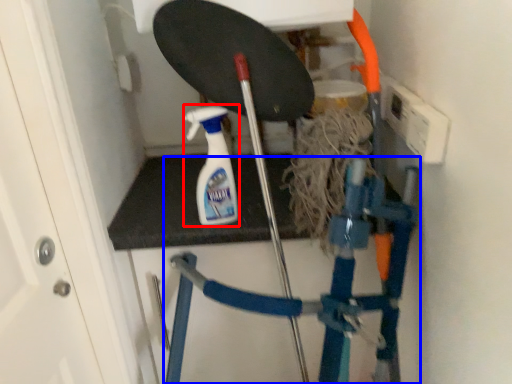
Question: Which object is closer to the camera taking this photo, cleaning product (highlighted by a red box) or ladder (highlighted by a blue box)?

Choices:
 (A) cleaning product
 (B) ladder

Answer: (A)